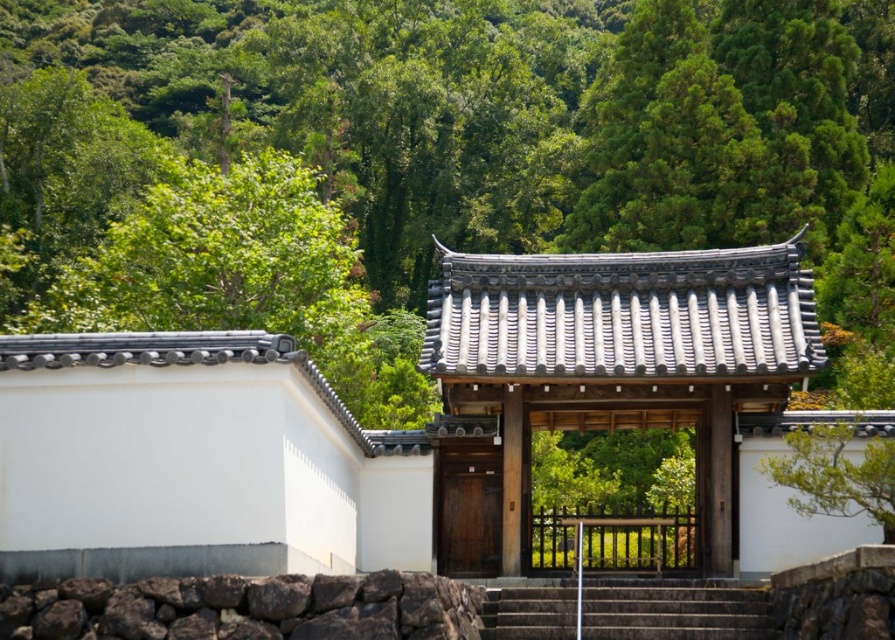
Question: Does dark gray stone stairs at center appear on the left side of wooden door at center?

Choices:
 (A) yes
 (B) no

Answer: (B)

Question: Estimate the real-world distances between objects in this image. Which object is farther from the dark gray stone stairs at center?

Choices:
 (A) dark brown rough stone at lower center
 (B) wooden door at center

Answer: (B)

Question: Among these objects, which one is nearest to the camera?

Choices:
 (A) wooden door at center
 (B) dark gray stone stairs at center

Answer: (B)

Question: Is dark brown rough stone at lower center to the right of dark gray stone stairs at center from the viewer's perspective?

Choices:
 (A) yes
 (B) no

Answer: (B)

Question: Which of the following is the closest to the observer?

Choices:
 (A) dark gray stone stairs at center
 (B) wooden door at center
 (C) dark brown rough stone at lower center

Answer: (C)

Question: Is dark brown rough stone at lower center above wooden door at center?

Choices:
 (A) no
 (B) yes

Answer: (A)